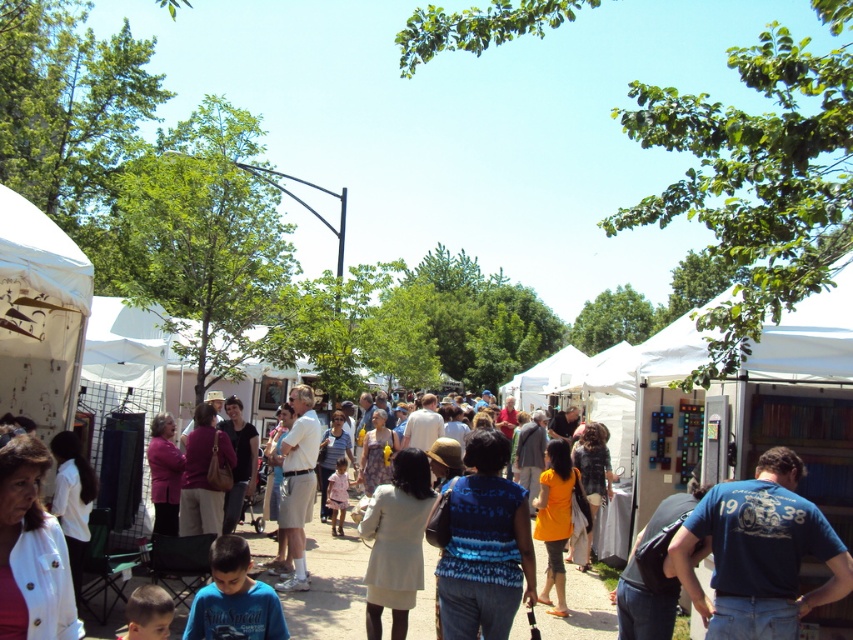
Where is the blue patterned shirt at center located in the image?

The blue patterned shirt at center is located at point (485, 545) in the image.